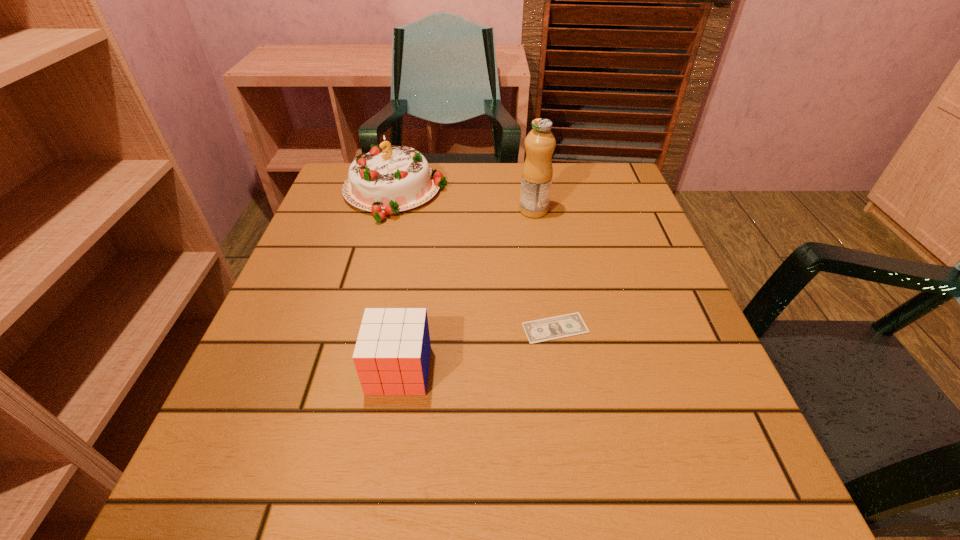
Where is `fruit juice`? The image size is (960, 540). fruit juice is located at coordinates (537, 171).

The width and height of the screenshot is (960, 540). I want to click on cake, so click(x=386, y=180).

Where is `the nearest object`? This screenshot has width=960, height=540. the nearest object is located at coordinates (392, 353).

The height and width of the screenshot is (540, 960). I want to click on cube, so click(x=392, y=353).

The width and height of the screenshot is (960, 540). I want to click on the second nearest object, so click(x=557, y=327).

This screenshot has width=960, height=540. What are the coordinates of `money` in the screenshot? It's located at (557, 327).

Find the location of a particular element. vacant space located on the front label of the tallest object is located at coordinates (368, 211).

You are a GUI agent. You are given a task and a screenshot of the screen. Output one action in this format:
    pyautogui.click(x=<x>, y=<y>)
    Task: Click on the free space located 0.340m on the front label of the tallest object
    The width and height of the screenshot is (960, 540).
    Given the screenshot: What is the action you would take?
    pyautogui.click(x=376, y=211)

The height and width of the screenshot is (540, 960). I want to click on free space located on the front label of the tallest object, so click(x=410, y=211).

What are the coordinates of `vacant space situated on the right of the second tallest object` in the screenshot? It's located at (499, 193).